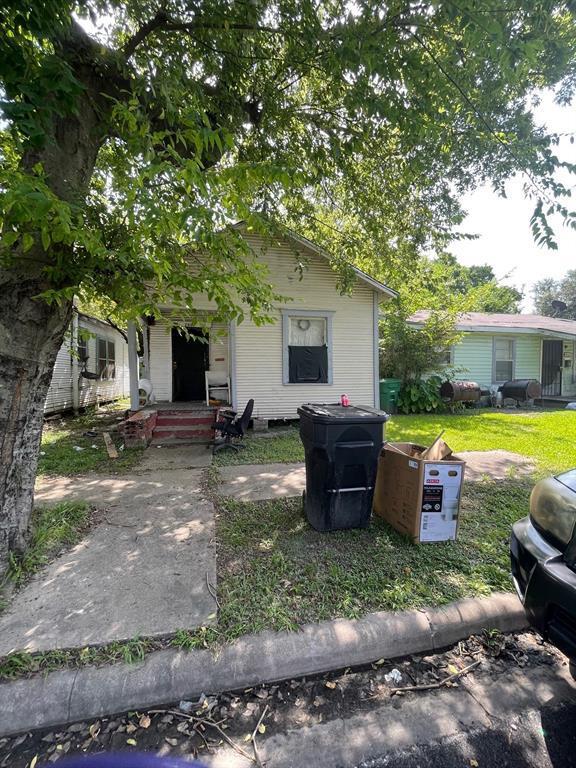
Locate an element on the screen. The width and height of the screenshot is (576, 768). wreath is located at coordinates (301, 325).